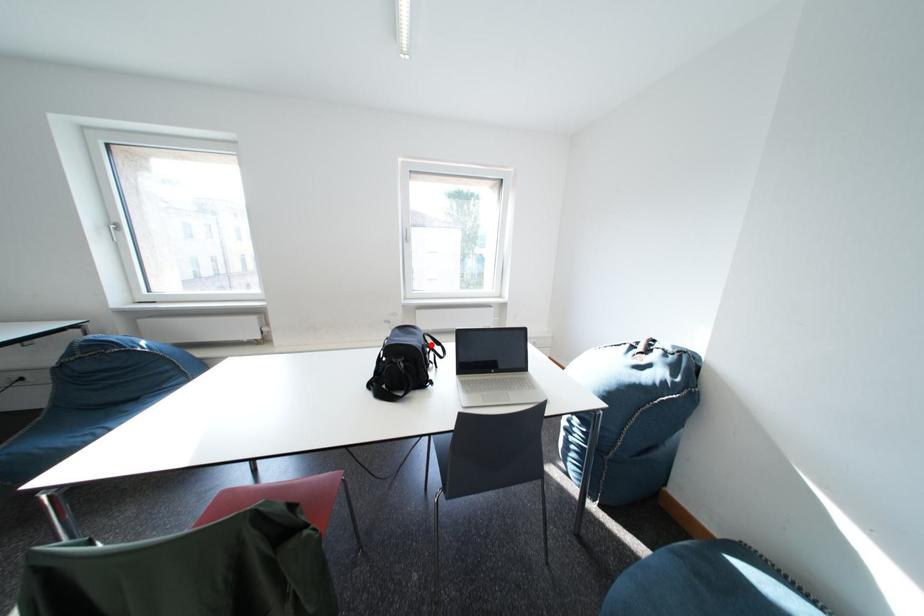
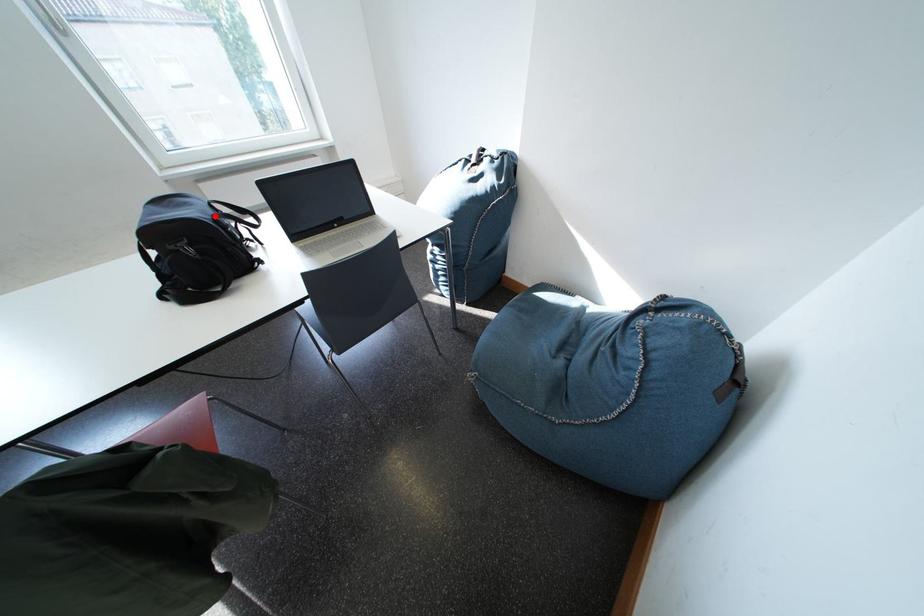
I am providing you with two images of the same scene from different viewpoints. A red point is marked on the first image and another point is marked on the second image. Do the highlighted points in image1 and image2 indicate the same real-world spot?

Yes